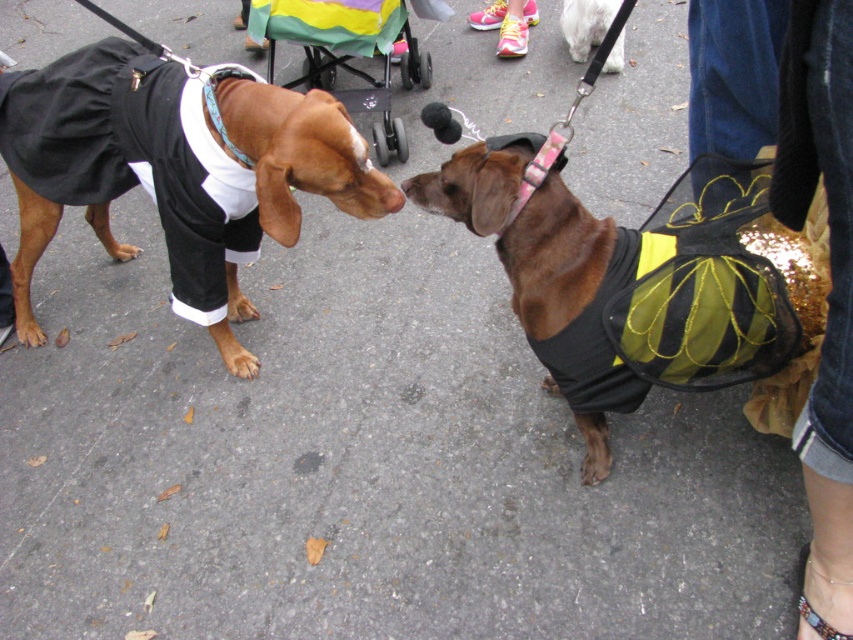
Question: Does shiny black vest at center have a lesser width compared to pink fabric neckband at center?

Choices:
 (A) yes
 (B) no

Answer: (B)

Question: Among these objects, which one is farthest from the camera?

Choices:
 (A) brown fur dog at center
 (B) white fur at upper center
 (C) pink fabric neckband at center

Answer: (B)

Question: Which object is the farthest from the brown fur dog at center?

Choices:
 (A) shiny black vest at center
 (B) shiny gold sequin purse at lower right
 (C) pink fabric neckband at center
 (D) teal fabric neckband at upper left

Answer: (B)

Question: Is shiny black vest at center to the left of rainbow fabric stroller at center from the viewer's perspective?

Choices:
 (A) yes
 (B) no

Answer: (B)

Question: Is brown fur dog at center wider than white fur at upper center?

Choices:
 (A) yes
 (B) no

Answer: (A)

Question: Considering the real-world distances, which object is closest to the teal fabric neckband at upper left?

Choices:
 (A) white fur at upper center
 (B) brown fur dog at center

Answer: (B)